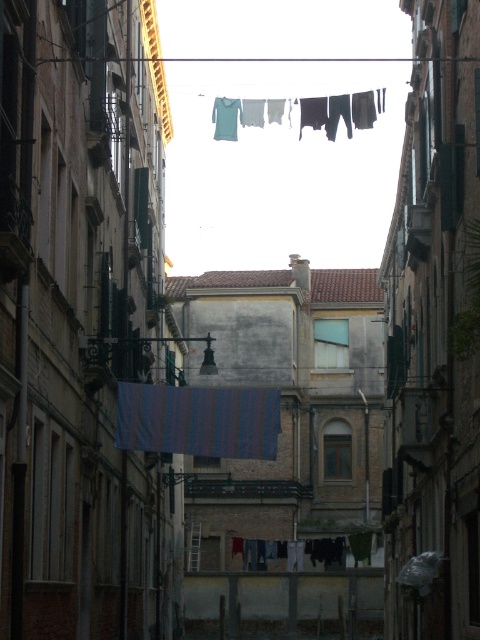
Question: Is the position of striped fabric at center more distant than that of striped fabric clothesline at center?

Choices:
 (A) yes
 (B) no

Answer: (B)

Question: Which of the following is the closest to the observer?

Choices:
 (A) (297, 99)
 (B) (232, 426)

Answer: (B)

Question: Observing the image, what is the correct spatial positioning of striped fabric at center in reference to striped fabric clothesline at center?

Choices:
 (A) above
 (B) below

Answer: (B)

Question: Is striped fabric at center wider than striped fabric clothesline at center?

Choices:
 (A) yes
 (B) no

Answer: (B)

Question: Which of the following is the closest to the observer?

Choices:
 (A) striped fabric at center
 (B) striped fabric clothesline at center

Answer: (A)